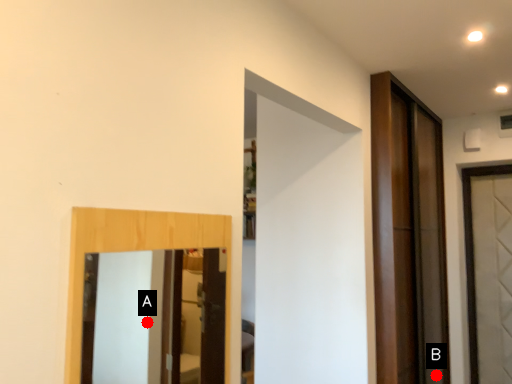
Question: Two points are circled on the image, labeled by A and B beside each circle. Which point appears farthest from the camera in this image?

Choices:
 (A) A is further
 (B) B is further

Answer: (A)